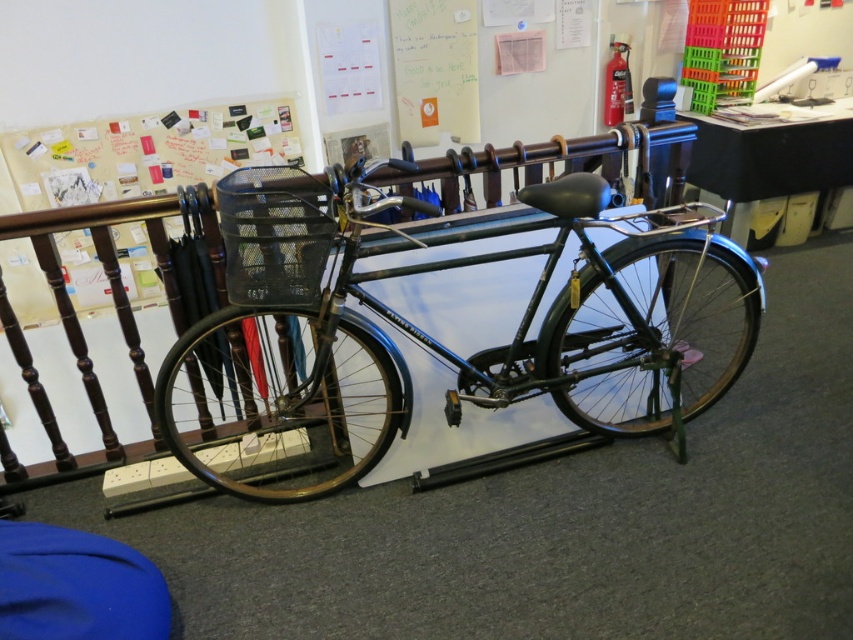
You are standing in an office space and see a point marked at coordinates (426, 333). What object is located exactly at that point?

The shiny black bicycle at center is located exactly at point (426, 333).

Based on the photo, you are a delivery person who needs to move the shiny black bicycle at center into a storage room that is 6 feet away from your current position. Can you reach the storage room without moving the bicycle first?

The distance between the shiny black bicycle at center and the camera is 5.55 feet. Since the storage room is 6 feet away, you can reach it without moving the bicycle first because the distance to the storage room is slightly longer than the bicycle.

Please describe the location of the shiny black bicycle at center in the image using coordinates.

The shiny black bicycle at center is located at coordinates point (426,333).